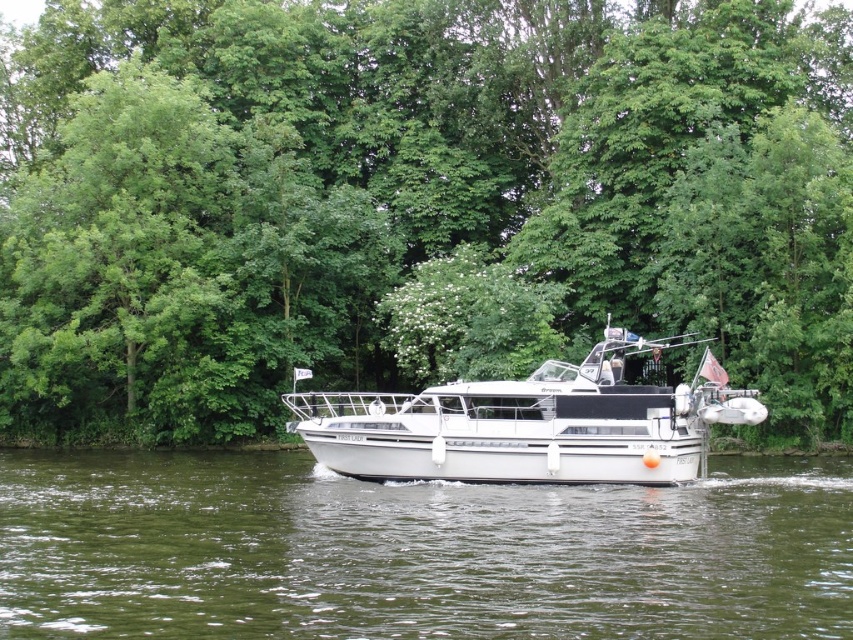
You are standing on the dock and want to throw a stone to hit both the green leafy trees at center and the green water at center. Which one will the stone hit first?

The green water at center will be hit first because it is closer to you than the green leafy trees at center, which are 16.97 meters away from the green water at center.

You are a photographer planning to take a photo of the green leafy trees at center and the green water at center from the white motorboat. Which object will appear larger in the photo?

The green leafy trees at center will appear larger in the photo because they are much taller than the green water at center.

You are a photographer planning to capture the riverside scene. You want to ensure that the green leafy trees at center and the green water at center are both visible in your shot. Based on their sizes, which object should you focus on to include both in the frame?

The green leafy trees at center have a larger width than the green water at center. To include both in the frame, focus on the green leafy trees at center since their greater width might require more space, ensuring the green water at center also fits.